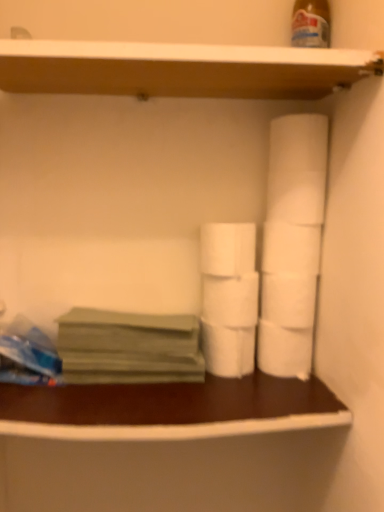
Question: Can you confirm if wooden at upper center is taller than green matte paper at left?

Choices:
 (A) no
 (B) yes

Answer: (A)

Question: Is green matte paper at left at the back of wooden at upper center?

Choices:
 (A) yes
 (B) no

Answer: (B)

Question: Is wooden at upper center surrounding green matte paper at left?

Choices:
 (A) no
 (B) yes

Answer: (A)

Question: From the image's perspective, is wooden at upper center beneath green matte paper at left?

Choices:
 (A) no
 (B) yes

Answer: (A)

Question: Is wooden at upper center outside green matte paper at left?

Choices:
 (A) yes
 (B) no

Answer: (A)

Question: Visually, is green matte paper at left positioned to the left or to the right of white matte toilet paper at center, the 2th toilet paper when ordered from top to bottom?

Choices:
 (A) left
 (B) right

Answer: (A)

Question: Considering the positions of green matte paper at left and white matte toilet paper at center, arranged as the fifth toilet paper when ordered from the bottom, in the image, is green matte paper at left wider or thinner than white matte toilet paper at center, arranged as the fifth toilet paper when ordered from the bottom,?

Choices:
 (A) wide
 (B) thin

Answer: (A)

Question: Considering the positions of green matte paper at left and white matte toilet paper at center, arranged as the fifth toilet paper when ordered from the bottom, in the image, is green matte paper at left bigger or smaller than white matte toilet paper at center, arranged as the fifth toilet paper when ordered from the bottom,?

Choices:
 (A) small
 (B) big

Answer: (B)

Question: Is point (167, 373) positioned closer to the camera than point (223, 232)?

Choices:
 (A) closer
 (B) farther

Answer: (B)

Question: Is white matte toilet paper at center, positioned as the third toilet paper in top-to-bottom order, bigger or smaller than white matte toilet paper at center-right, which is the first toilet paper in top-to-bottom order?

Choices:
 (A) big
 (B) small

Answer: (A)

Question: From the image's perspective, is white matte toilet paper at center, which ranks as the fourth toilet paper in bottom-to-top order, located above or below white matte toilet paper at center-right, placed as the 6th toilet paper when sorted from bottom to top?

Choices:
 (A) below
 (B) above

Answer: (A)

Question: Is point (246, 284) closer or farther from the camera than point (296, 257)?

Choices:
 (A) farther
 (B) closer

Answer: (A)

Question: Visually, is white matte toilet paper at center, positioned as the third toilet paper in top-to-bottom order, positioned to the left or to the right of white matte toilet paper at center-right, placed as the 6th toilet paper when sorted from bottom to top?

Choices:
 (A) right
 (B) left

Answer: (B)

Question: From the image's perspective, relative to wooden at upper center, is green matte paper at left above or below?

Choices:
 (A) below
 (B) above

Answer: (A)

Question: Considering their positions, is green matte paper at left located in front of or behind wooden at upper center?

Choices:
 (A) front
 (B) behind

Answer: (B)